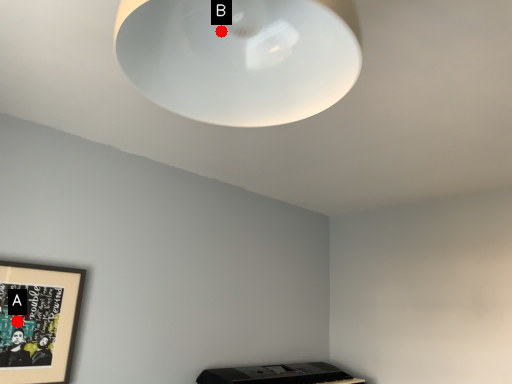
Question: Two points are circled on the image, labeled by A and B beside each circle. Which point appears farthest from the camera in this image?

Choices:
 (A) A is further
 (B) B is further

Answer: (A)